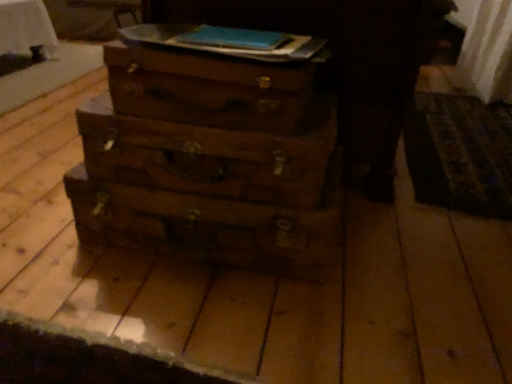
In order to face wooden drawer at center, positioned as the third drawer in bottom-to-top order, should I rotate leftwards or rightwards?

To face it directly, rotate left by 4.110 degrees.

In order to face wooden drawer at center, marked as the 2th drawer in a top-to-bottom arrangement, should I rotate leftwards or rightwards?

You should look left and rotate roughly 6.383 degrees.

This screenshot has width=512, height=384. What are the coordinates of `wooden chest at center` in the screenshot? It's located at (343, 60).

Between wooden drawer at center, which is the third drawer in top-to-bottom order, and wooden drawer at center, acting as the 1th drawer starting from the top, which one appears on the right side from the viewer's perspective?

Positioned to the right is wooden drawer at center, acting as the 1th drawer starting from the top.

Is wooden drawer at center, the first drawer when ordered from bottom to top, spatially inside wooden drawer at center, acting as the 1th drawer starting from the top, or outside of it?

wooden drawer at center, the first drawer when ordered from bottom to top, is not inside wooden drawer at center, acting as the 1th drawer starting from the top, it's outside.

Between wooden drawer at center, which is the third drawer in top-to-bottom order, and wooden drawer at center, positioned as the third drawer in bottom-to-top order, which one has larger size?

wooden drawer at center, which is the third drawer in top-to-bottom order, is bigger.

Is wooden chest at center beside wooden drawer at center, marked as the 2th drawer in a top-to-bottom arrangement?

wooden chest at center is not next to wooden drawer at center, marked as the 2th drawer in a top-to-bottom arrangement, and they're not touching.

Is wooden chest at center shorter than wooden drawer at center, marked as the 2th drawer in a top-to-bottom arrangement?

Incorrect, the height of wooden chest at center does not fall short of that of wooden drawer at center, marked as the 2th drawer in a top-to-bottom arrangement.

From the image's perspective, which one is positioned lower, wooden chest at center or wooden drawer at center, marked as the 2th drawer in a top-to-bottom arrangement?

wooden drawer at center, marked as the 2th drawer in a top-to-bottom arrangement.

Is wooden chest at center outside of wooden drawer at center, marked as the 2th drawer in a top-to-bottom arrangement?

Yes.

Based on the photo, is wooden drawer at center, arranged as the second drawer when ordered from the bottom, with wooden drawer at center, acting as the 1th drawer starting from the top?

Yes, wooden drawer at center, arranged as the second drawer when ordered from the bottom, is beside wooden drawer at center, acting as the 1th drawer starting from the top.

Is wooden drawer at center, acting as the 1th drawer starting from the top, inside wooden drawer at center, arranged as the second drawer when ordered from the bottom?

No, wooden drawer at center, acting as the 1th drawer starting from the top, is not a part of wooden drawer at center, arranged as the second drawer when ordered from the bottom.

Based on the photo, which of these two, wooden drawer at center, arranged as the second drawer when ordered from the bottom, or wooden drawer at center, positioned as the third drawer in bottom-to-top order, is thinner?

wooden drawer at center, positioned as the third drawer in bottom-to-top order, is thinner.

From the image's perspective, which one is positioned lower, wooden drawer at center, marked as the 2th drawer in a top-to-bottom arrangement, or wooden drawer at center, positioned as the third drawer in bottom-to-top order?

From the image's view, wooden drawer at center, marked as the 2th drawer in a top-to-bottom arrangement, is below.

Starting from the wooden chest at center, which drawer is the 1st one in front? Please provide its 2D coordinates.

[(209, 226)]

Considering the sizes of objects wooden drawer at center, which is the third drawer in top-to-bottom order, and wooden chest at center in the image provided, who is shorter, wooden drawer at center, which is the third drawer in top-to-bottom order, or wooden chest at center?

wooden drawer at center, which is the third drawer in top-to-bottom order.

Does wooden drawer at center, which is the third drawer in top-to-bottom order, have a lesser width compared to wooden chest at center?

Yes.

Is wooden drawer at center, arranged as the second drawer when ordered from the bottom, positioned with its back to wooden chest at center?

No, wooden drawer at center, arranged as the second drawer when ordered from the bottom, is not facing the opposite direction of wooden chest at center.

In terms of height, does wooden drawer at center, marked as the 2th drawer in a top-to-bottom arrangement, look taller or shorter compared to wooden chest at center?

Considering their sizes, wooden drawer at center, marked as the 2th drawer in a top-to-bottom arrangement, has less height than wooden chest at center.

Does point (315, 159) appear closer or farther from the camera than point (336, 25)?

Point (315, 159).

From the picture: Which of these two, wooden drawer at center, arranged as the second drawer when ordered from the bottom, or wooden chest at center, is smaller?

Smaller between the two is wooden drawer at center, arranged as the second drawer when ordered from the bottom.

Is wooden drawer at center, acting as the 1th drawer starting from the top, looking in the opposite direction of wooden drawer at center, which is the third drawer in top-to-bottom order?

No, wooden drawer at center, which is the third drawer in top-to-bottom order, is not at the back of wooden drawer at center, acting as the 1th drawer starting from the top.

Based on the photo, from a real-world perspective, is wooden drawer at center, positioned as the third drawer in bottom-to-top order, below wooden drawer at center, which is the third drawer in top-to-bottom order?

No, from a real-world perspective, wooden drawer at center, positioned as the third drawer in bottom-to-top order, is not beneath wooden drawer at center, which is the third drawer in top-to-bottom order.

Based on the photo, does wooden drawer at center, acting as the 1th drawer starting from the top, have a lesser width compared to wooden drawer at center, which is the third drawer in top-to-bottom order?

Indeed, wooden drawer at center, acting as the 1th drawer starting from the top, has a lesser width compared to wooden drawer at center, which is the third drawer in top-to-bottom order.

Can you confirm if wooden drawer at center, arranged as the second drawer when ordered from the bottom, is shorter than wooden drawer at center, the first drawer when ordered from bottom to top?

Incorrect, the height of wooden drawer at center, arranged as the second drawer when ordered from the bottom, does not fall short of that of wooden drawer at center, the first drawer when ordered from bottom to top.

In the scene shown: From a real-world perspective, is wooden drawer at center, marked as the 2th drawer in a top-to-bottom arrangement, physically located above or below wooden drawer at center, the first drawer when ordered from bottom to top?

wooden drawer at center, marked as the 2th drawer in a top-to-bottom arrangement, is situated higher than wooden drawer at center, the first drawer when ordered from bottom to top, in the real world.

Looking at this image, does wooden drawer at center, arranged as the second drawer when ordered from the bottom, have a greater width compared to wooden drawer at center, the first drawer when ordered from bottom to top?

No, wooden drawer at center, arranged as the second drawer when ordered from the bottom, is not wider than wooden drawer at center, the first drawer when ordered from bottom to top.

Locate an element on the screen. The width and height of the screenshot is (512, 384). the 1st drawer to the left of the wooden drawer at center, acting as the 1th drawer starting from the top, starting your count from the anchor is located at coordinates (209, 226).

Identify the location of dark behind the wooden drawer at center, marked as the 2th drawer in a top-to-bottom arrangement. This screenshot has width=512, height=384. (343, 60).

Which object lies further to the anchor point wooden drawer at center, the first drawer when ordered from bottom to top, wooden drawer at center, acting as the 1th drawer starting from the top, or wooden drawer at center, arranged as the second drawer when ordered from the bottom?

wooden drawer at center, acting as the 1th drawer starting from the top, is further to wooden drawer at center, the first drawer when ordered from bottom to top.

Looking at the image, which one is located closer to wooden drawer at center, positioned as the third drawer in bottom-to-top order, wooden drawer at center, marked as the 2th drawer in a top-to-bottom arrangement, or wooden chest at center?

wooden drawer at center, marked as the 2th drawer in a top-to-bottom arrangement, is positioned closer to the anchor wooden drawer at center, positioned as the third drawer in bottom-to-top order.

From the image, which object appears to be farther from wooden drawer at center, acting as the 1th drawer starting from the top, wooden drawer at center, which is the third drawer in top-to-bottom order, or wooden drawer at center, arranged as the second drawer when ordered from the bottom?

wooden drawer at center, which is the third drawer in top-to-bottom order, is further to wooden drawer at center, acting as the 1th drawer starting from the top.

When comparing their distances from wooden drawer at center, which is the third drawer in top-to-bottom order, does wooden chest at center or wooden drawer at center, acting as the 1th drawer starting from the top, seem further?

Among the two, wooden chest at center is located further to wooden drawer at center, which is the third drawer in top-to-bottom order.

Estimate the real-world distances between objects in this image. Which object is closer to wooden drawer at center, marked as the 2th drawer in a top-to-bottom arrangement, wooden drawer at center, which is the third drawer in top-to-bottom order, or wooden chest at center?

wooden drawer at center, which is the third drawer in top-to-bottom order, is positioned closer to the anchor wooden drawer at center, marked as the 2th drawer in a top-to-bottom arrangement.

From the image, which object appears to be nearer to wooden drawer at center, arranged as the second drawer when ordered from the bottom, wooden chest at center or wooden drawer at center, acting as the 1th drawer starting from the top?

wooden drawer at center, acting as the 1th drawer starting from the top, lies closer to wooden drawer at center, arranged as the second drawer when ordered from the bottom, than the other object.

From the image, which object appears to be farther from wooden drawer at center, positioned as the third drawer in bottom-to-top order, wooden chest at center or wooden drawer at center, arranged as the second drawer when ordered from the bottom?

Based on the image, wooden chest at center appears to be further to wooden drawer at center, positioned as the third drawer in bottom-to-top order.

From the image, which object appears to be nearer to wooden drawer at center, arranged as the second drawer when ordered from the bottom, wooden drawer at center, acting as the 1th drawer starting from the top, or wooden chest at center?

Among the two, wooden drawer at center, acting as the 1th drawer starting from the top, is located nearer to wooden drawer at center, arranged as the second drawer when ordered from the bottom.

Identify the location of drawer between wooden drawer at center, positioned as the third drawer in bottom-to-top order, and wooden drawer at center, which is the third drawer in top-to-bottom order, from top to bottom. This screenshot has width=512, height=384. (208, 156).

Locate an element on the screen. This screenshot has width=512, height=384. drawer between wooden chest at center and wooden drawer at center, arranged as the second drawer when ordered from the bottom, vertically is located at coordinates (208, 88).